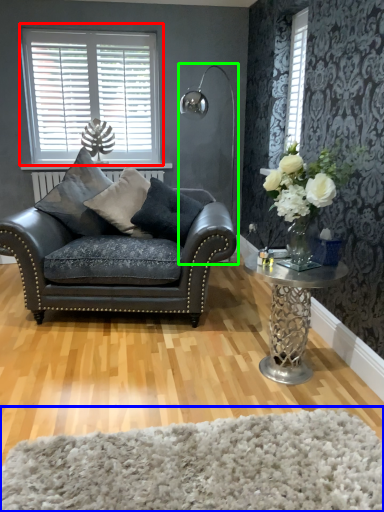
Question: Which is farther away from window (highlighted by a red box)? plain (highlighted by a blue box) or lamp (highlighted by a green box)?

Choices:
 (A) plain
 (B) lamp

Answer: (A)